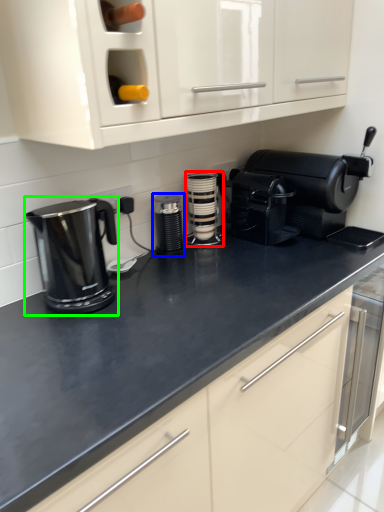
Question: Which object is positioned closest to kitchen appliance (highlighted by a red box)? Select from kitchen appliance (highlighted by a blue box) and home appliance (highlighted by a green box).

Choices:
 (A) kitchen appliance
 (B) home appliance

Answer: (A)